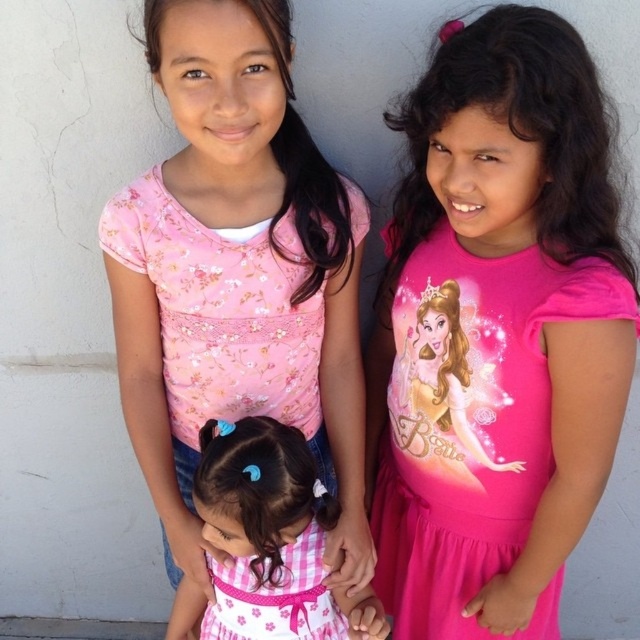
You are a photographer trying to capture a clear shot of both the pink satin dress at center and the pink checkered dress at center. Since they are both at the center, which one will appear larger in the photo?

The pink satin dress at center will appear larger in the photo because it is closer to the viewer than the pink checkered dress at center.

You are a photographer trying to adjust the lighting for a group photo. You need to ensure that the pink floral shirt at center is well lit. Where should you position the main light source relative to the girls?

The main light source should be positioned in front of the girls, facing the pink floral shirt at center to ensure it is well lit.